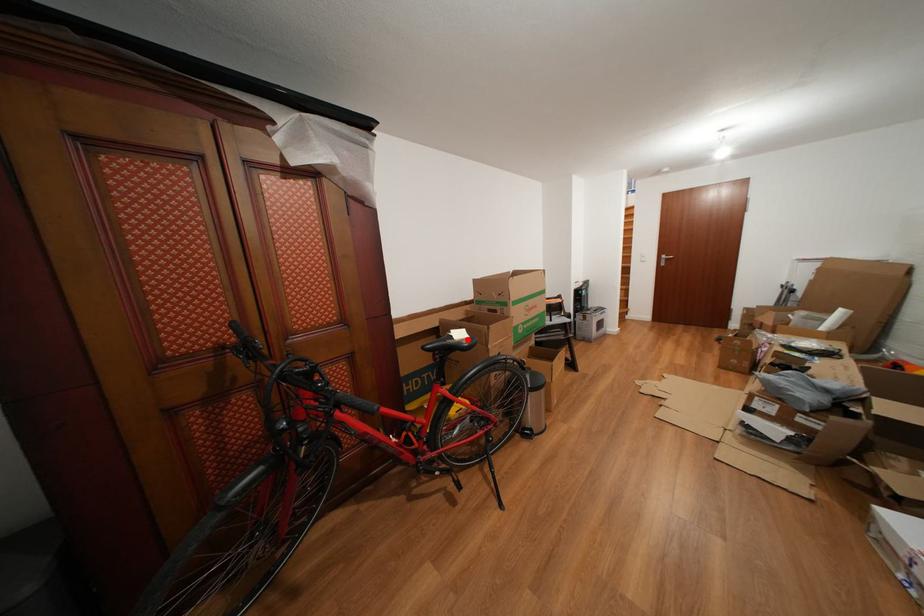
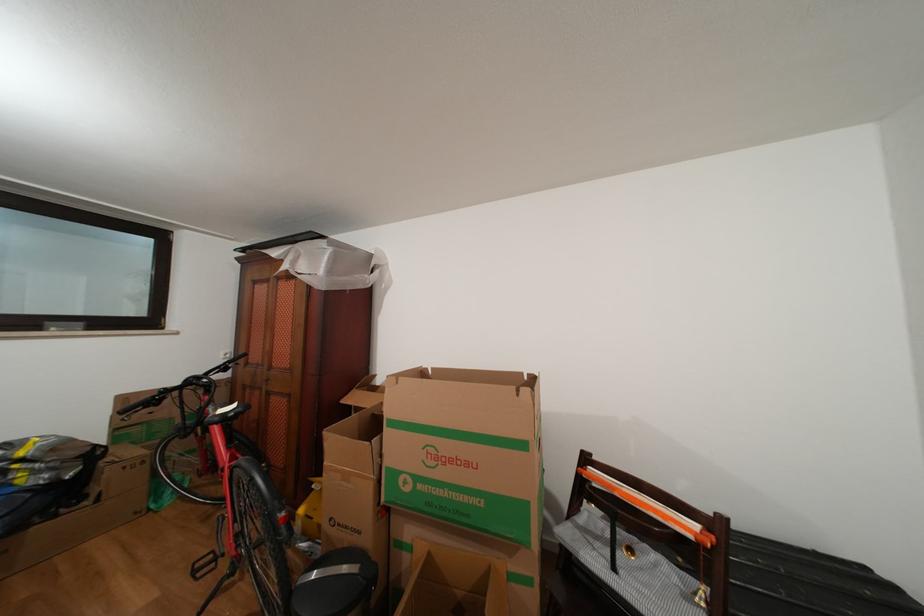
Find the pixel in the second image that matches the highlighted location in the first image.

(237, 413)